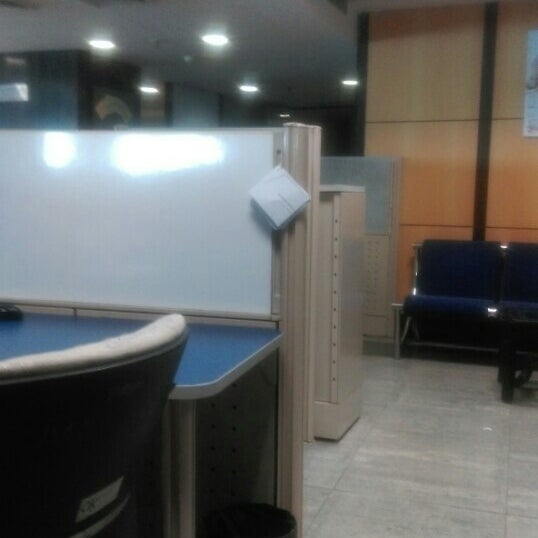
Find the location of `desk`. desk is located at coordinates (221, 350).